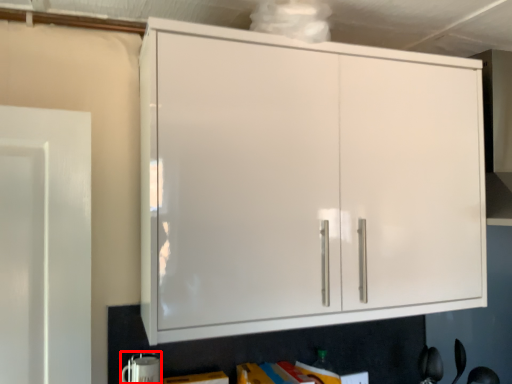
Question: From the image's perspective, what is the correct spatial relationship of appliance (annotated by the red box) in relation to cupboard?

Choices:
 (A) below
 (B) above

Answer: (A)